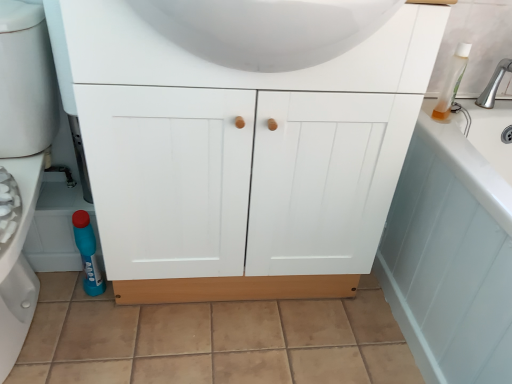
The image size is (512, 384). Find the location of `empty space that is ontop of beige ceramic tile at lower center (from a real-world perspective)`. empty space that is ontop of beige ceramic tile at lower center (from a real-world perspective) is located at coordinates (194, 324).